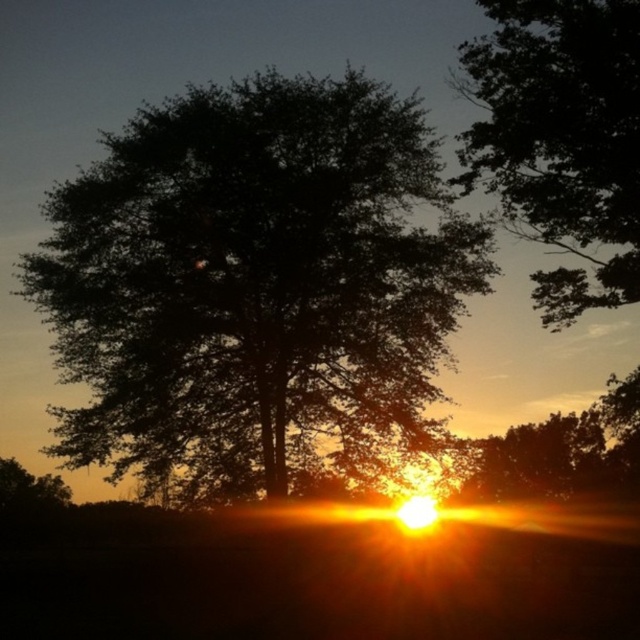
You are standing in the sunset scene and want to place a small flag at each of the two points marked in the image. The first point is at coordinates point (234, 403) and the second is at point (637, 179). Which flag will be closer to your viewpoint?

The flag placed at point (234, 403) will be closer to your viewpoint because it is further to the viewer than point (637, 179).

You are an observer standing in front of the dark green leafy tree at center and the dark green leafy tree at upper center. Which tree appears larger in the image?

The dark green leafy tree at center appears larger because it is taller than the dark green leafy tree at upper center.

You are an artist trying to paint this sunset scene. You want to ensure the dark green leafy tree at center and the dark green leafy tree at upper center are proportionally accurate. Which tree should you paint larger?

The dark green leafy tree at center should be painted larger than the dark green leafy tree at upper center because it is described as larger in size.